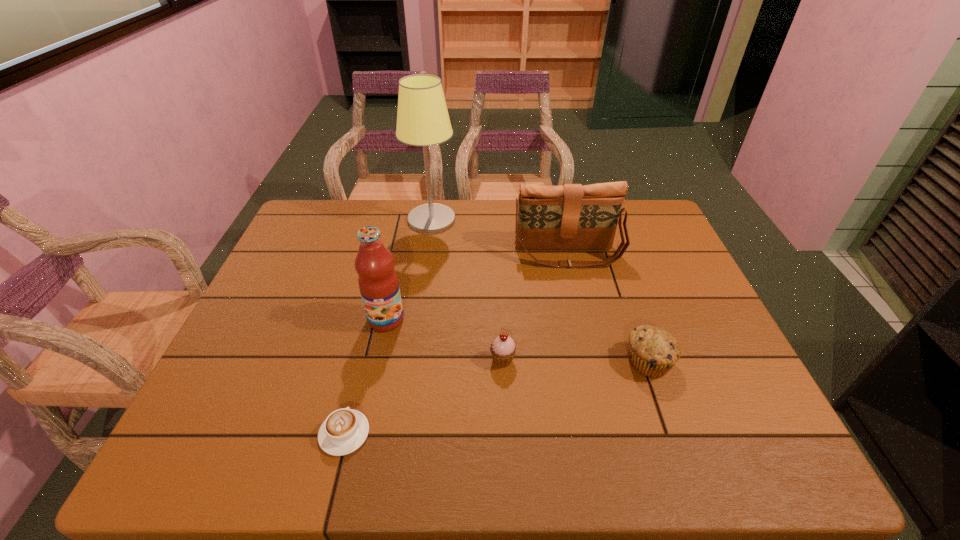
This screenshot has height=540, width=960. Identify the location of vacant space situated 0.320m on the right of the tallest object. (553, 220).

Locate an element on the screen. The height and width of the screenshot is (540, 960). vacant space located on the front label of the fifth shortest object is located at coordinates (377, 362).

Identify the location of vacant area situated 0.200m on the front-facing side of the fourth shortest object. The height and width of the screenshot is (540, 960). (583, 320).

Where is `vacant space located on the back of the muffin`? This screenshot has width=960, height=540. vacant space located on the back of the muffin is located at coordinates (607, 242).

Find the location of a particular element. The height and width of the screenshot is (540, 960). vacant space positioned 0.210m on the left of the cupcake is located at coordinates (400, 360).

This screenshot has width=960, height=540. I want to click on vacant area situated 0.300m with the handle on the right side of the cappuccino, so click(374, 309).

What are the coordinates of `vacant position located with the handle on the right side of the cappuccino` in the screenshot? It's located at (377, 299).

You are a GUI agent. You are given a task and a screenshot of the screen. Output one action in this format:
    pyautogui.click(x=<x>, y=<y>)
    Task: Click on the free space located 0.080m with the handle on the right side of the cappuccino
    This screenshot has height=540, width=960.
    Given the screenshot: What is the action you would take?
    pyautogui.click(x=357, y=380)

Identify the location of table lamp that is positioned at the far edge. The image size is (960, 540). (422, 118).

The height and width of the screenshot is (540, 960). I want to click on shoulder bag that is at the far edge, so click(566, 217).